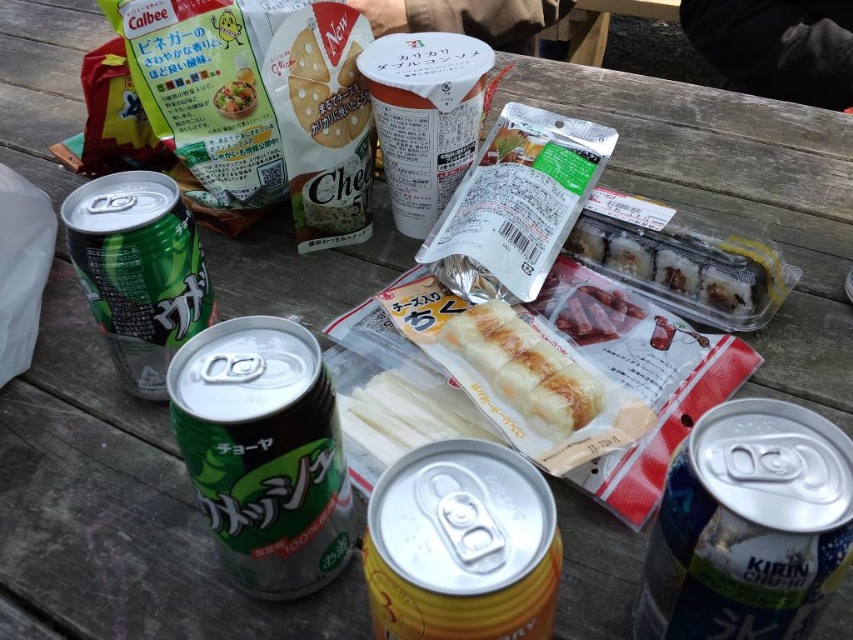
Is green matte can at center closer to camera compared to shiny red meat at center?

Yes, it is in front of shiny red meat at center.

Which is above, green matte can at center or shiny red meat at center?

Positioned higher is shiny red meat at center.

Who is more forward, (228, 484) or (560, 278)?

Point (228, 484) is more forward.

Where is `green matte can at center`? Image resolution: width=853 pixels, height=640 pixels. green matte can at center is located at coordinates (264, 452).

Who is lower down, golden brown bread at center or shiny red meat at center?

golden brown bread at center

Can you confirm if golden brown bread at center is thinner than shiny red meat at center?

Incorrect, golden brown bread at center's width is not less than shiny red meat at center's.

Is point (577, 392) farther from viewer compared to point (622, 291)?

No, (577, 392) is in front of (622, 291).

At what (x,y) coordinates should I click in order to perform the action: click on golden brown bread at center. Please return your answer as a coordinate pair (x, y). Looking at the image, I should click on (524, 369).

Between shiny red meat at center and matte plastic bag at upper left, which one has less height?

matte plastic bag at upper left

Can you confirm if shiny red meat at center is positioned to the right of matte plastic bag at upper left?

Correct, you'll find shiny red meat at center to the right of matte plastic bag at upper left.

Locate an element on the screen. shiny red meat at center is located at coordinates (587, 305).